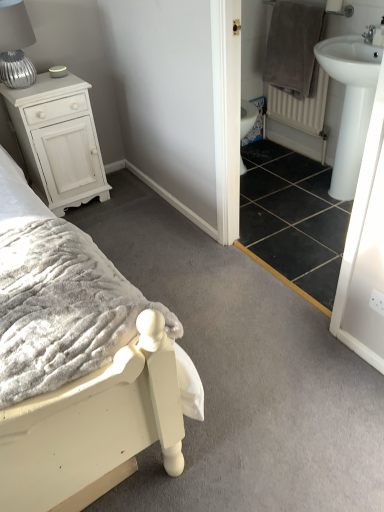
I want to click on free space to the right of white painted wood chest of drawers at upper left, so click(129, 201).